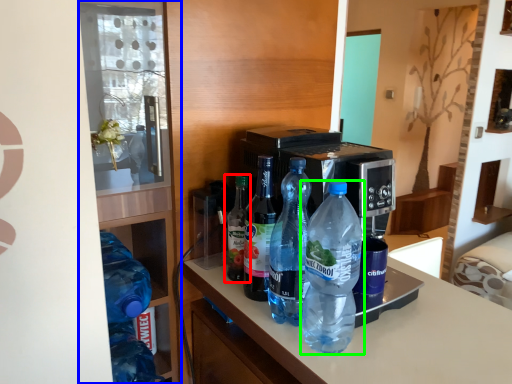
Question: Which is nearer to the bottle (highlighted by a red box)? shelf (highlighted by a blue box) or bottle (highlighted by a green box).

Choices:
 (A) shelf
 (B) bottle

Answer: (A)